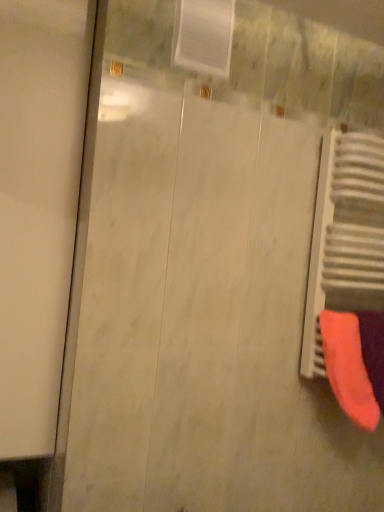
Question: Should I look upward or downward to see neon pink fabric at lower right?

Choices:
 (A) down
 (B) up

Answer: (A)